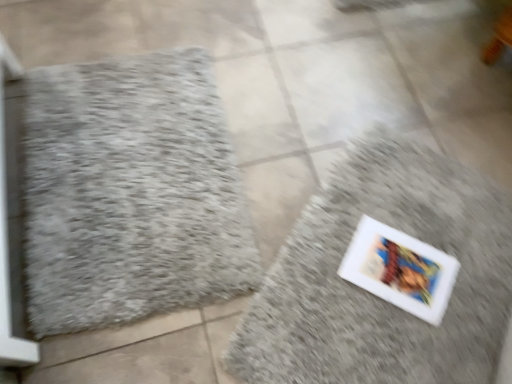
I want to click on blank space above gray fluffy bath mat at left, the 2th bath mat when ordered from right to left (from a real-world perspective), so click(127, 166).